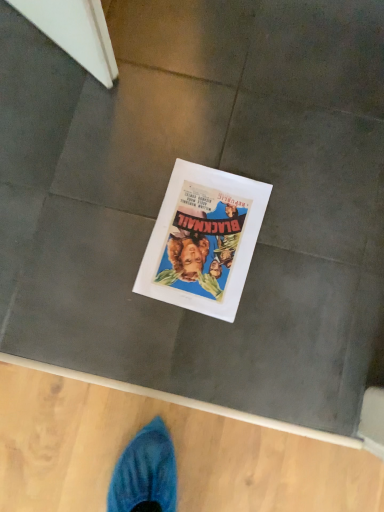
Locate an element on the screen. The image size is (384, 512). matte paper poster at center is located at coordinates (203, 240).

Describe the element at coordinates (203, 240) in the screenshot. I see `matte paper poster at center` at that location.

The height and width of the screenshot is (512, 384). In order to click on matte paper poster at center in this screenshot , I will do `click(203, 240)`.